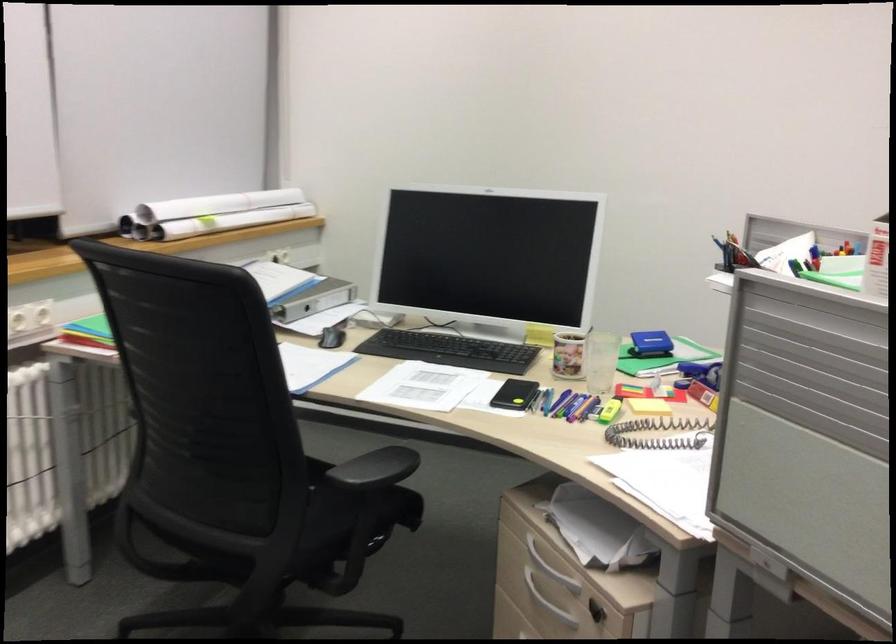
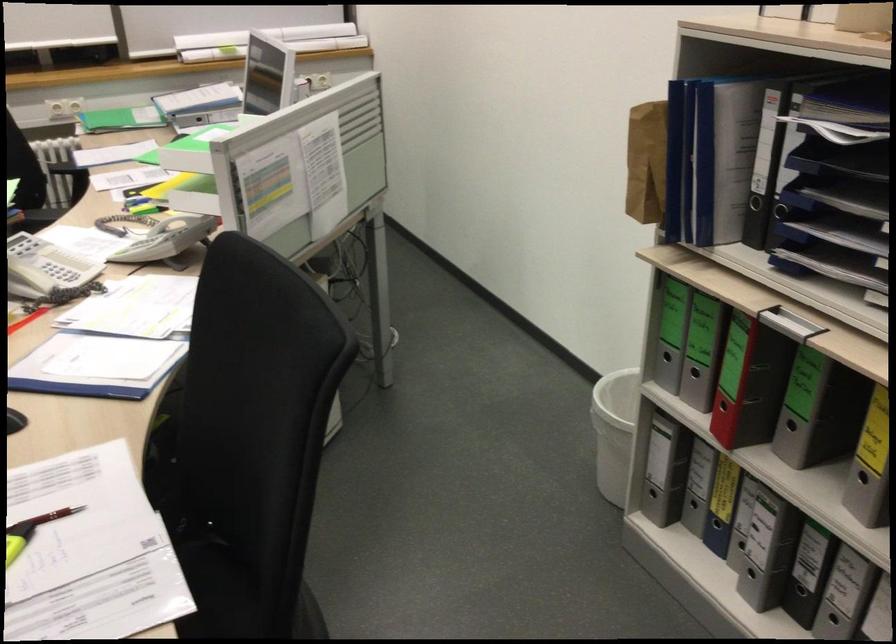
Question: I am providing you with two images of the same scene from different viewpoints. Which of the following objects are not visible in image2?

Choices:
 (A) black binder finger hole
 (B) small wooden crate
 (C) red binder finger hole
 (D) clear drinking glass

Answer: (D)